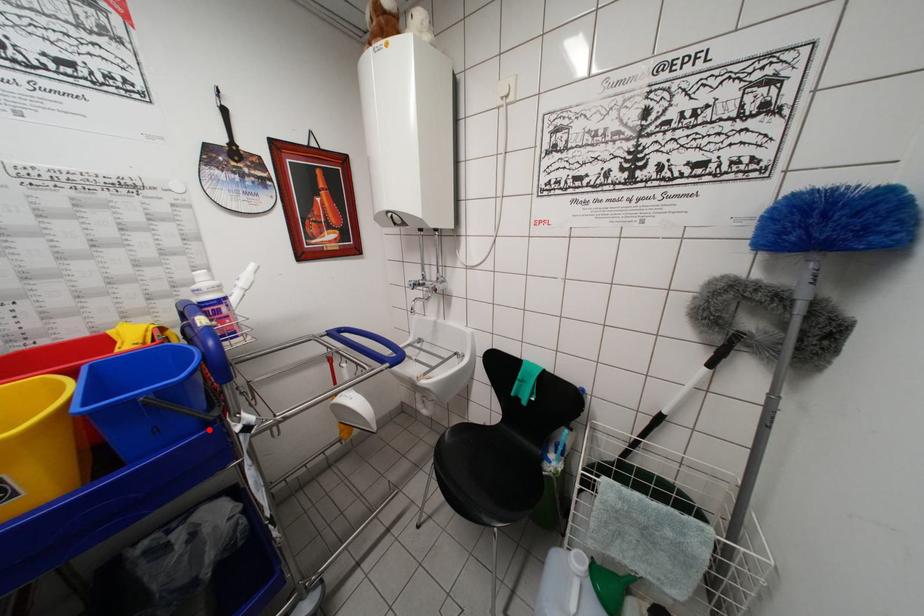
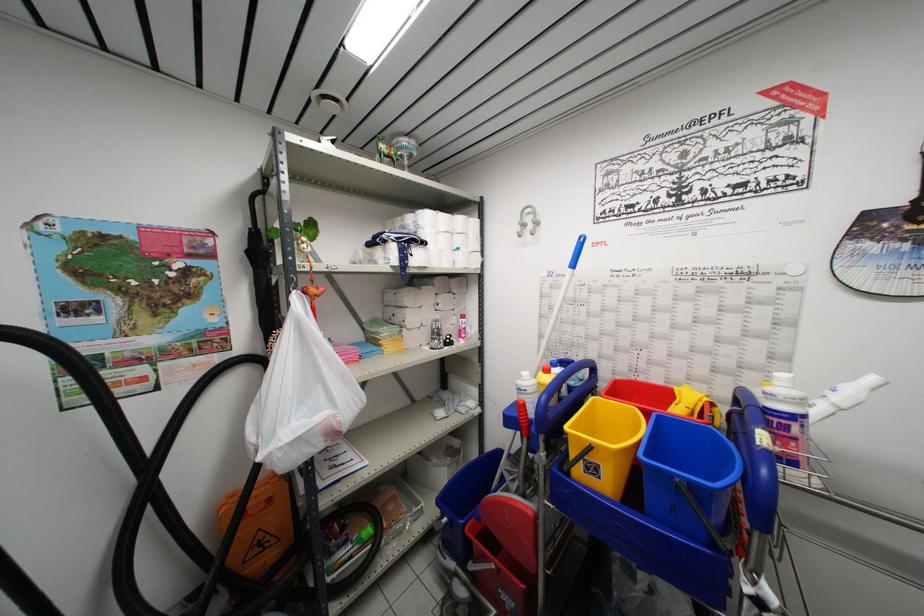
In the second image, find the point that corresponds to the highlighted location in the first image.

(718, 552)